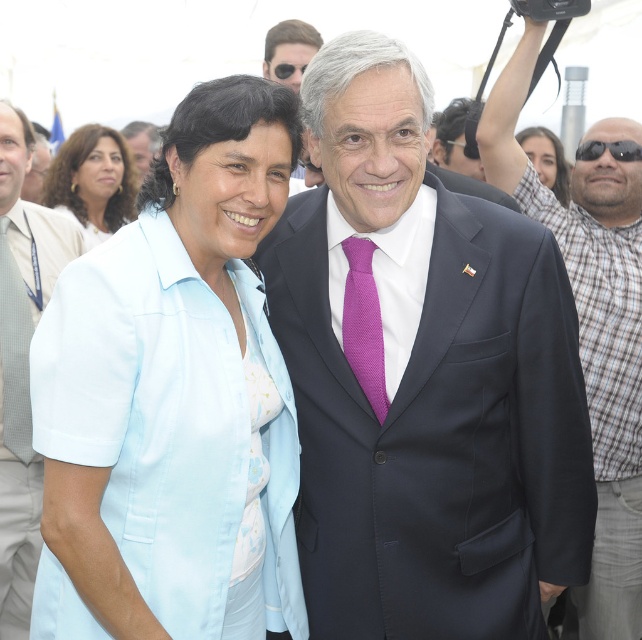
You are standing at the point with coordinates point (135, 170) and want to take a photo of the person at point (311, 596). Is there any obstruction between you and your subject?

Point (311, 596) is in front of point (135, 170), so there is no obstruction between you and the person at point (311, 596).

You are a photographer at the event and need to adjust the lighting to highlight both the white cotton shirt at left and the matte white blouse at upper left. Which of the two should you position closer to the light source to ensure even illumination?

The white cotton shirt at left is to the right of matte white blouse at upper left. Since the matte white blouse at upper left is positioned further from the light source, you should move it closer to ensure even illumination between both garments.